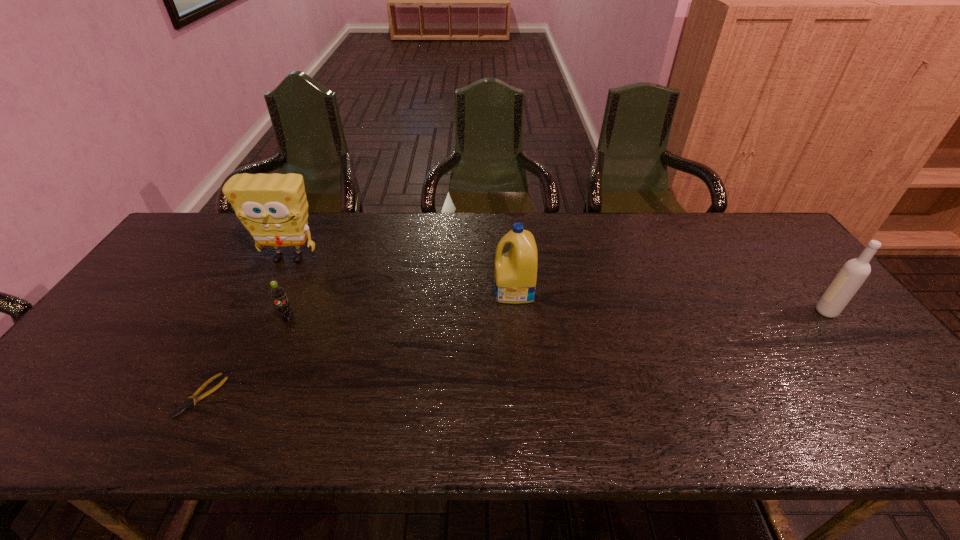
Find the location of a particular element. free region located on the label of the detergent is located at coordinates (442, 291).

Where is `vacant area situated on the front label of the second shortest object`? vacant area situated on the front label of the second shortest object is located at coordinates (251, 404).

The height and width of the screenshot is (540, 960). Find the location of `vacant space located on the left of the shortest object`. vacant space located on the left of the shortest object is located at coordinates (135, 396).

Where is `object that is at the far edge`? object that is at the far edge is located at coordinates (273, 207).

Locate an element on the screen. The width and height of the screenshot is (960, 540). object located in the near edge section of the desktop is located at coordinates (189, 402).

You are a GUI agent. You are given a task and a screenshot of the screen. Output one action in this format:
    pyautogui.click(x=<x>, y=<y>)
    Task: Click on the object that is at the right edge
    
    Given the screenshot: What is the action you would take?
    pyautogui.click(x=854, y=272)

The height and width of the screenshot is (540, 960). I want to click on vacant space at the far edge of the desktop, so click(x=726, y=236).

You are a GUI agent. You are given a task and a screenshot of the screen. Output one action in this format:
    pyautogui.click(x=<x>, y=<y>)
    Task: Click on the free point at the near edge
    The width and height of the screenshot is (960, 540).
    Given the screenshot: What is the action you would take?
    pyautogui.click(x=146, y=433)

In the image, there is a desktop. Where is `free space at the left edge`? free space at the left edge is located at coordinates (190, 259).

This screenshot has width=960, height=540. I want to click on vacant space at the right edge, so click(886, 369).